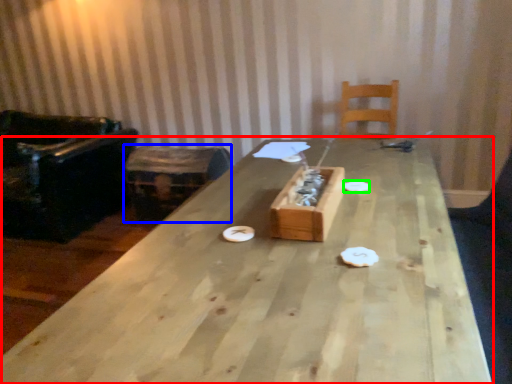
Question: Estimate the real-world distances between objects in this image. Which object is closer to table (highlighted by a red box), storage box (highlighted by a blue box) or paper plate (highlighted by a green box)?

Choices:
 (A) storage box
 (B) paper plate

Answer: (B)